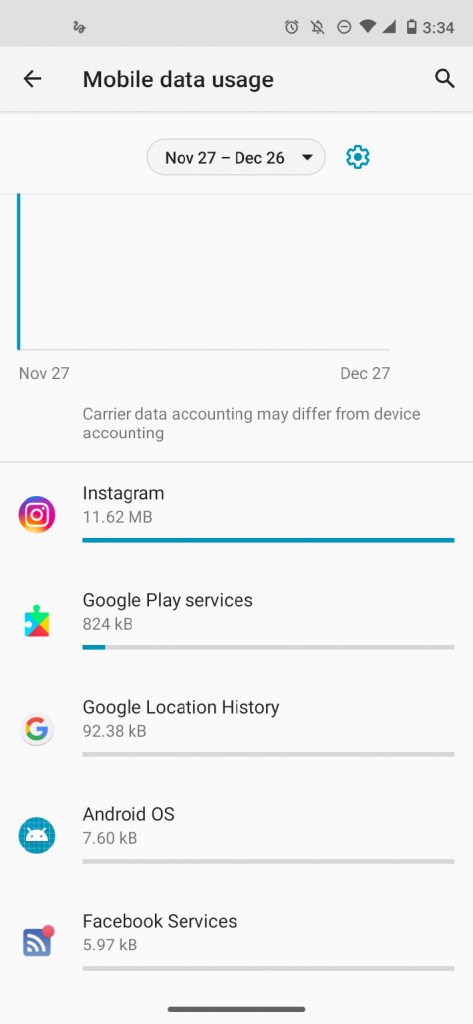
Identify the location of wifi. The height and width of the screenshot is (1024, 473). (368, 25).